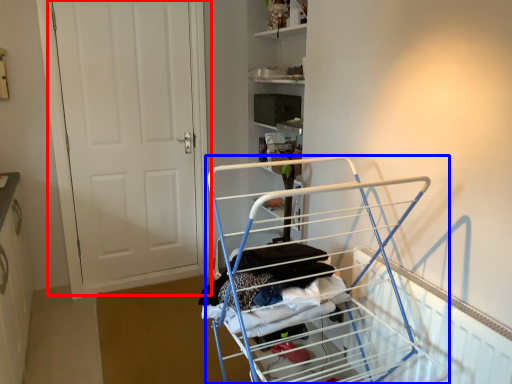
Question: Among these objects, which one is nearest to the camera, door (highlighted by a red box) or furniture (highlighted by a blue box)?

Choices:
 (A) door
 (B) furniture

Answer: (B)